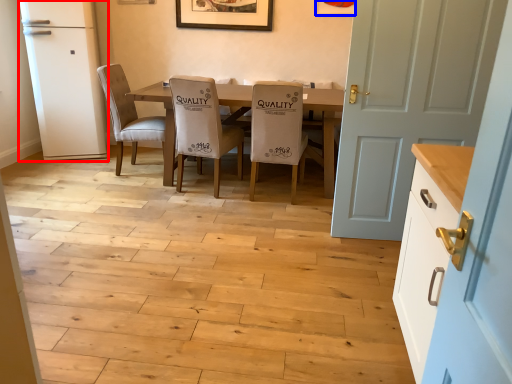
Question: Among these objects, which one is nearest to the camera, fridge (highlighted by a red box) or picture frame (highlighted by a blue box)?

Choices:
 (A) fridge
 (B) picture frame

Answer: (A)